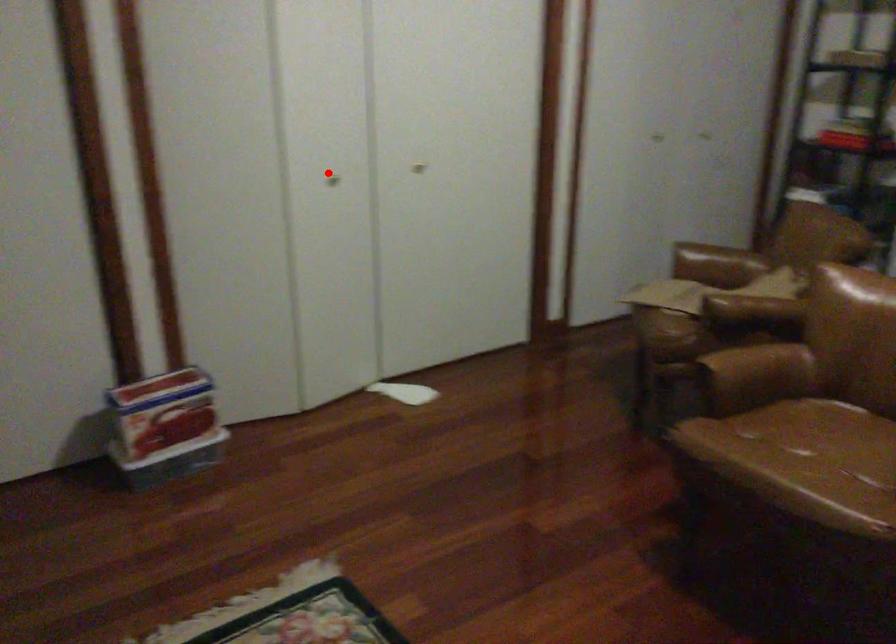
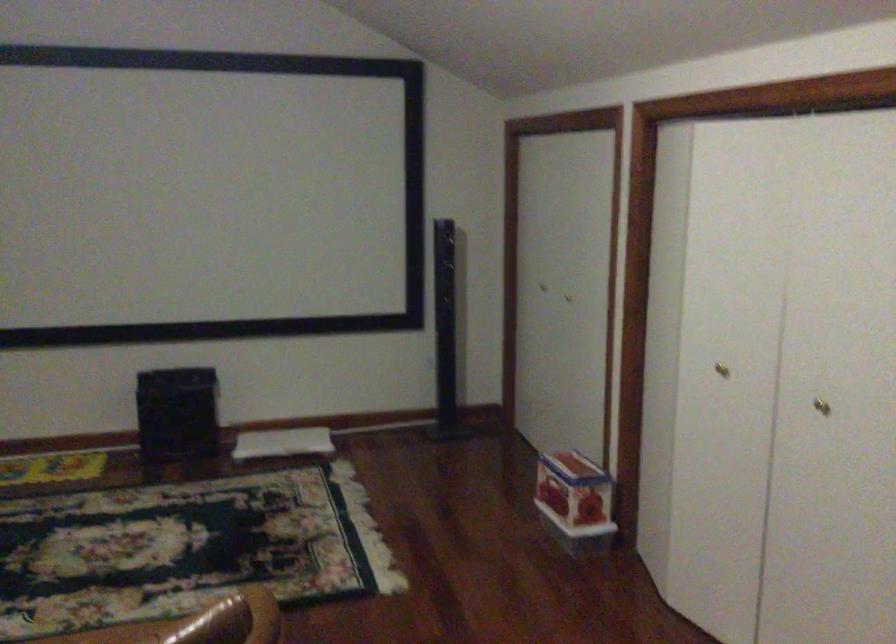
Question: A red point is marked in image1. In image2, is the corresponding 3D point closer to the camera or farther? Reply with the corresponding letter.

Choices:
 (A) The corresponding 3D point is closer.
 (B) The corresponding 3D point is farther.

Answer: (A)